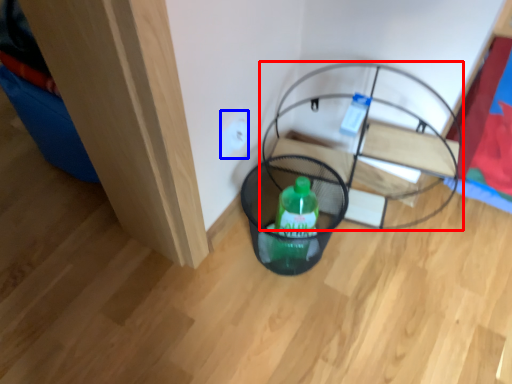
Question: Which object appears closest to the camera in this image, furniture (highlighted by a red box) or electric outlet (highlighted by a blue box)?

Choices:
 (A) furniture
 (B) electric outlet

Answer: (A)